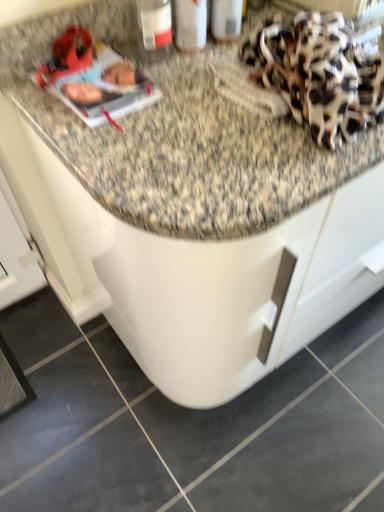
Describe the element at coordinates (94, 79) in the screenshot. I see `matte plastic magazine at upper left` at that location.

Locate an element on the screen. The height and width of the screenshot is (512, 384). matte plastic magazine at upper left is located at coordinates (94, 79).

How different are the orientations of leopard print fabric at upper right and matte plastic magazine at upper left in degrees?

The angle between the facing direction of leopard print fabric at upper right and the facing direction of matte plastic magazine at upper left is 0.304 degrees.

Can you see leopard print fabric at upper right touching matte plastic magazine at upper left?

leopard print fabric at upper right is not next to matte plastic magazine at upper left, and they're not touching.

Can you confirm if leopard print fabric at upper right is smaller than matte plastic magazine at upper left?

Incorrect, leopard print fabric at upper right is not smaller in size than matte plastic magazine at upper left.

From the image's perspective, is leopard print fabric at upper right on top of matte plastic magazine at upper left?

Yes, from the image's perspective, leopard print fabric at upper right is above matte plastic magazine at upper left.

Consider the image. Is matte plastic bottle at upper center positioned with its back to matte plastic magazine at upper left?

No, matte plastic bottle at upper center's orientation is not away from matte plastic magazine at upper left.

From a real-world perspective, who is located higher, matte plastic bottle at upper center or matte plastic magazine at upper left?

matte plastic bottle at upper center.

Which is in front, point (162, 57) or point (117, 106)?

The point (117, 106) is more forward.

How much distance is there between matte plastic bottle at upper center and matte plastic magazine at upper left?

5.45 inches.

Image resolution: width=384 pixels, height=512 pixels. In order to click on stuff on the right of the matte plastic bottle at upper center in this screenshot , I will do `click(319, 74)`.

Is leopard print fabric at upper right a part of matte plastic bottle at upper center?

Actually, leopard print fabric at upper right is outside matte plastic bottle at upper center.

Based on their sizes in the image, would you say matte plastic bottle at upper center is bigger or smaller than leopard print fabric at upper right?

Clearly, matte plastic bottle at upper center is smaller in size than leopard print fabric at upper right.

Considering the sizes of objects matte plastic bottle at upper center and leopard print fabric at upper right in the image provided, who is taller, matte plastic bottle at upper center or leopard print fabric at upper right?

With more height is matte plastic bottle at upper center.

Between matte plastic magazine at upper left and matte plastic bottle at upper center, which one has less height?

matte plastic magazine at upper left is shorter.

Which is less distant, (126, 91) or (143, 3)?

Point (126, 91) appears to be farther away from the viewer than point (143, 3).

Is the surface of matte plastic magazine at upper left in direct contact with matte plastic bottle at upper center?

matte plastic magazine at upper left and matte plastic bottle at upper center are clearly separated.

Is matte plastic magazine at upper left positioned beyond the bounds of leopard print fabric at upper right?

Yes, matte plastic magazine at upper left is outside of leopard print fabric at upper right.

Which of these two, matte plastic magazine at upper left or leopard print fabric at upper right, is smaller?

matte plastic magazine at upper left.

From the image's perspective, is matte plastic magazine at upper left on leopard print fabric at upper right?

No, from the image's perspective, matte plastic magazine at upper left is not above leopard print fabric at upper right.

Which object is positioned more to the left, matte plastic magazine at upper left or leopard print fabric at upper right?

matte plastic magazine at upper left is more to the left.

Is point (343, 103) closer or farther from the camera than point (170, 25)?

Point (343, 103) is closer to the camera than point (170, 25).

I want to click on stuff to the right of matte plastic bottle at upper center, so click(x=319, y=74).

Looking at this image, is leopard print fabric at upper right bigger or smaller than matte plastic bottle at upper center?

In the image, leopard print fabric at upper right appears to be larger than matte plastic bottle at upper center.

Considering the relative sizes of leopard print fabric at upper right and matte plastic bottle at upper center in the image provided, is leopard print fabric at upper right thinner than matte plastic bottle at upper center?

Incorrect, the width of leopard print fabric at upper right is not less than that of matte plastic bottle at upper center.

Locate an element on the screen. The width and height of the screenshot is (384, 512). magazine below the leopard print fabric at upper right (from a real-world perspective) is located at coordinates (94, 79).

You are a GUI agent. You are given a task and a screenshot of the screen. Output one action in this format:
    pyautogui.click(x=<x>, y=<y>)
    Task: Click on the magazine on the left of matte plastic bottle at upper center
    Image resolution: width=384 pixels, height=512 pixels.
    Given the screenshot: What is the action you would take?
    pyautogui.click(x=94, y=79)

Considering their positions, is matte plastic magazine at upper left positioned further to leopard print fabric at upper right than matte plastic bottle at upper center?

matte plastic bottle at upper center lies further to leopard print fabric at upper right than the other object.

Estimate the real-world distances between objects in this image. Which object is closer to leopard print fabric at upper right, matte plastic bottle at upper center or matte plastic magazine at upper left?

Based on the image, matte plastic magazine at upper left appears to be nearer to leopard print fabric at upper right.

Estimate the real-world distances between objects in this image. Which object is closer to matte plastic magazine at upper left, leopard print fabric at upper right or matte plastic bottle at upper center?

matte plastic bottle at upper center is positioned closer to the anchor matte plastic magazine at upper left.

Consider the image. Which object lies further to the anchor point matte plastic bottle at upper center, matte plastic magazine at upper left or leopard print fabric at upper right?

Based on the image, leopard print fabric at upper right appears to be further to matte plastic bottle at upper center.

From the image, which object appears to be nearer to matte plastic bottle at upper center, leopard print fabric at upper right or matte plastic magazine at upper left?

matte plastic magazine at upper left lies closer to matte plastic bottle at upper center than the other object.

Estimate the real-world distances between objects in this image. Which object is further from matte plastic magazine at upper left, matte plastic bottle at upper center or leopard print fabric at upper right?

Among the two, leopard print fabric at upper right is located further to matte plastic magazine at upper left.

Find the location of `bottle located between matte plastic magazine at upper left and leopard print fabric at upper right in the left-right direction`. bottle located between matte plastic magazine at upper left and leopard print fabric at upper right in the left-right direction is located at coordinates (154, 29).